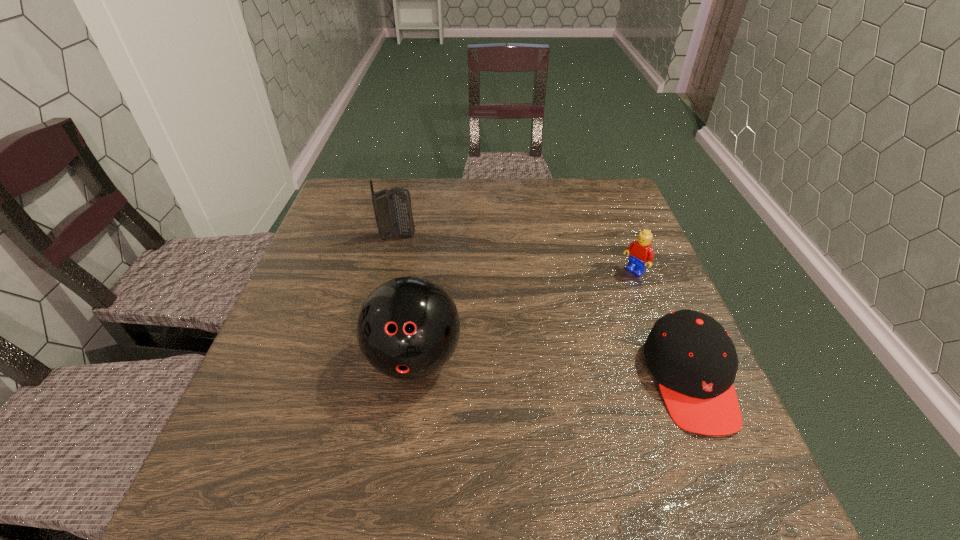
You are a GUI agent. You are given a task and a screenshot of the screen. Output one action in this format:
    pyautogui.click(x=<x>, y=<y>)
    Task: Click on the vacant space located 0.260m on the front-facing side of the third nearest object
    
    Given the screenshot: What is the action you would take?
    pyautogui.click(x=556, y=332)

Where is `object at the near edge`? Image resolution: width=960 pixels, height=540 pixels. object at the near edge is located at coordinates (693, 358).

Find the location of `cap that is at the right edge`. cap that is at the right edge is located at coordinates (693, 358).

Locate an element on the screen. The width and height of the screenshot is (960, 540). Lego present at the right edge is located at coordinates (640, 252).

Locate an element on the screen. This screenshot has width=960, height=540. object at the near right corner is located at coordinates 693,358.

This screenshot has width=960, height=540. I want to click on vacant space at the far edge, so [x=452, y=193].

The image size is (960, 540). In the image, there is a desktop. What are the coordinates of `vacant region at the near edge` in the screenshot? It's located at (468, 411).

The width and height of the screenshot is (960, 540). Identify the location of vacant space at the left edge of the desktop. (307, 287).

This screenshot has height=540, width=960. In the image, there is a desktop. In order to click on vacant region at the right edge in this screenshot , I will do `click(616, 304)`.

In order to click on free space at the far left corner of the desktop in this screenshot , I will do tap(377, 183).